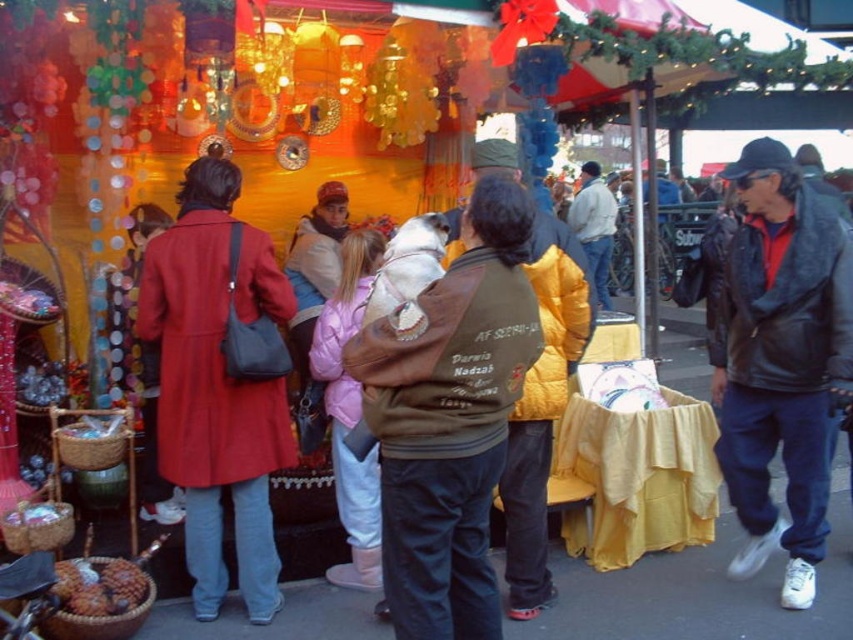
Question: Is brown leather jacket at center above matte red coat at left?

Choices:
 (A) no
 (B) yes

Answer: (A)

Question: Among these objects, which one is nearest to the camera?

Choices:
 (A) brown leather jacket at center
 (B) matte red coat at left

Answer: (A)

Question: Can you confirm if brown leather jacket at center is positioned below matte red coat at left?

Choices:
 (A) no
 (B) yes

Answer: (B)

Question: Does brown leather jacket at center have a lesser width compared to matte red coat at left?

Choices:
 (A) no
 (B) yes

Answer: (A)

Question: Among these points, which one is farthest from the camera?

Choices:
 (A) (503, 230)
 (B) (181, 264)

Answer: (B)